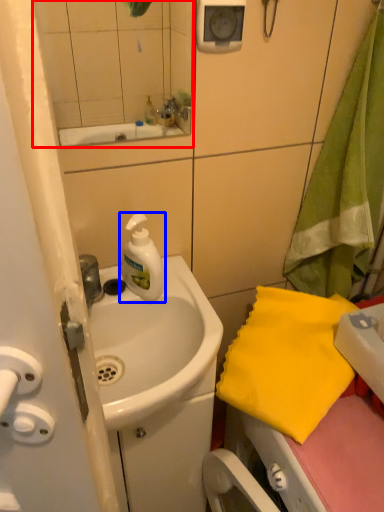
Question: Which object is further to the camera taking this photo, mirror (highlighted by a red box) or cleaning product (highlighted by a blue box)?

Choices:
 (A) mirror
 (B) cleaning product

Answer: (B)